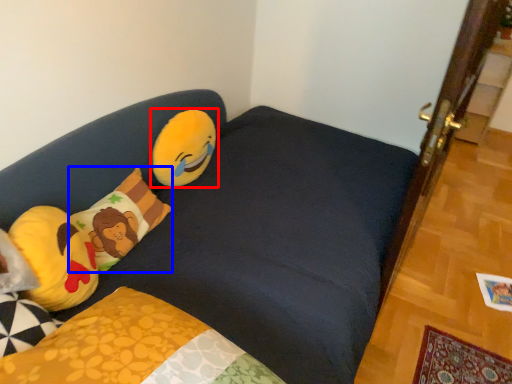
Question: Among these objects, which one is farthest to the camera, toy (highlighted by a red box) or pillow (highlighted by a blue box)?

Choices:
 (A) toy
 (B) pillow

Answer: (A)